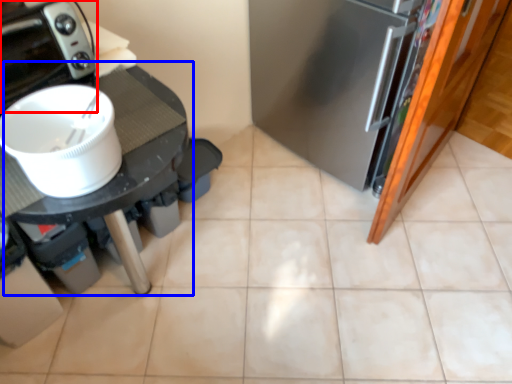
Question: Which object is further to the camera taking this photo, home appliance (highlighted by a red box) or table (highlighted by a blue box)?

Choices:
 (A) home appliance
 (B) table

Answer: (A)